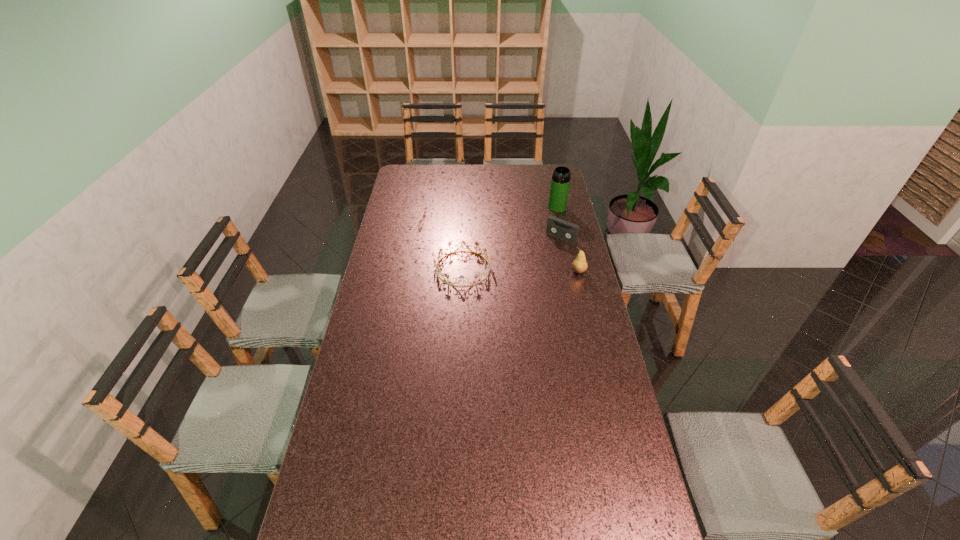
Find the location of `free region located on the front-facing side of the videotape`. free region located on the front-facing side of the videotape is located at coordinates (547, 251).

Where is `vacant area situated 0.310m on the front-facing side of the videotape`? vacant area situated 0.310m on the front-facing side of the videotape is located at coordinates (519, 282).

Locate an element on the screen. vacant position located 0.220m on the front-facing side of the videotape is located at coordinates (530, 270).

Locate an element on the screen. pear that is at the right edge is located at coordinates (579, 265).

The width and height of the screenshot is (960, 540). I want to click on thermos bottle that is at the right edge, so 560,183.

You are a GUI agent. You are given a task and a screenshot of the screen. Output one action in this format:
    pyautogui.click(x=<x>, y=<y>)
    Task: Click on the videotape that is at the right edge
    The height and width of the screenshot is (540, 960).
    Given the screenshot: What is the action you would take?
    (556, 227)

The height and width of the screenshot is (540, 960). I want to click on vacant region at the far edge, so click(471, 178).

Locate an element on the screen. This screenshot has width=960, height=540. vacant space at the near edge of the desktop is located at coordinates (380, 522).

In order to click on free region at the left edge in this screenshot , I will do `click(340, 477)`.

In the image, there is a desktop. At what (x,y) coordinates should I click in order to perform the action: click on vacant space at the right edge. Please return your answer as a coordinate pair (x, y). The width and height of the screenshot is (960, 540). Looking at the image, I should click on (574, 317).